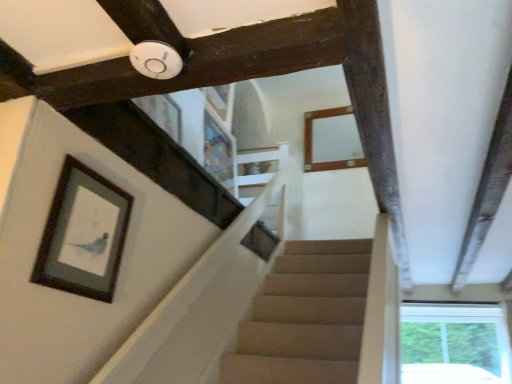
The height and width of the screenshot is (384, 512). What do you see at coordinates (83, 234) in the screenshot?
I see `matte black picture frame at left` at bounding box center [83, 234].

Locate an element on the screen. Image resolution: width=512 pixels, height=384 pixels. matte black picture frame at left is located at coordinates (83, 234).

At what (x,y) coordinates should I click in order to perform the action: click on matte black picture frame at left. Please return your answer as a coordinate pair (x, y). The width and height of the screenshot is (512, 384). Looking at the image, I should click on (83, 234).